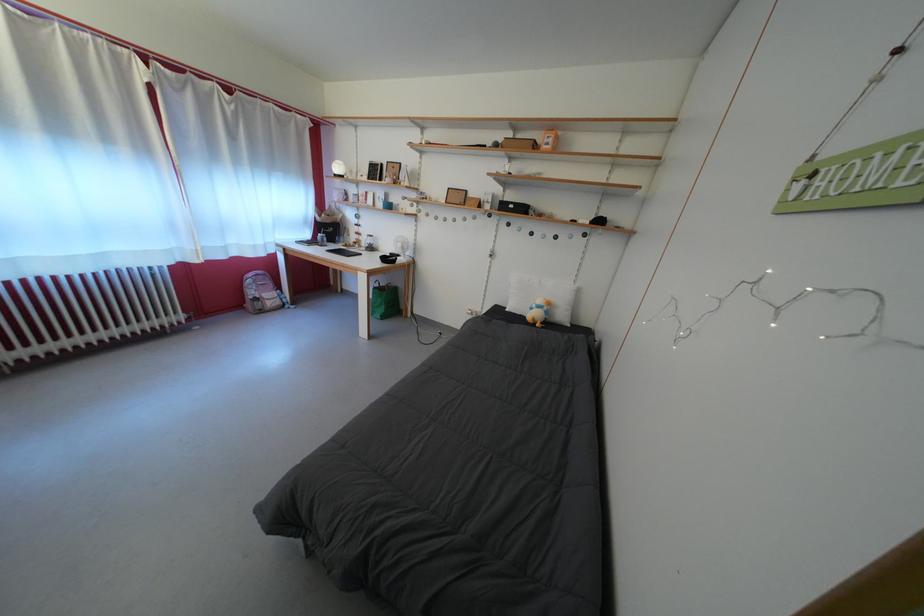
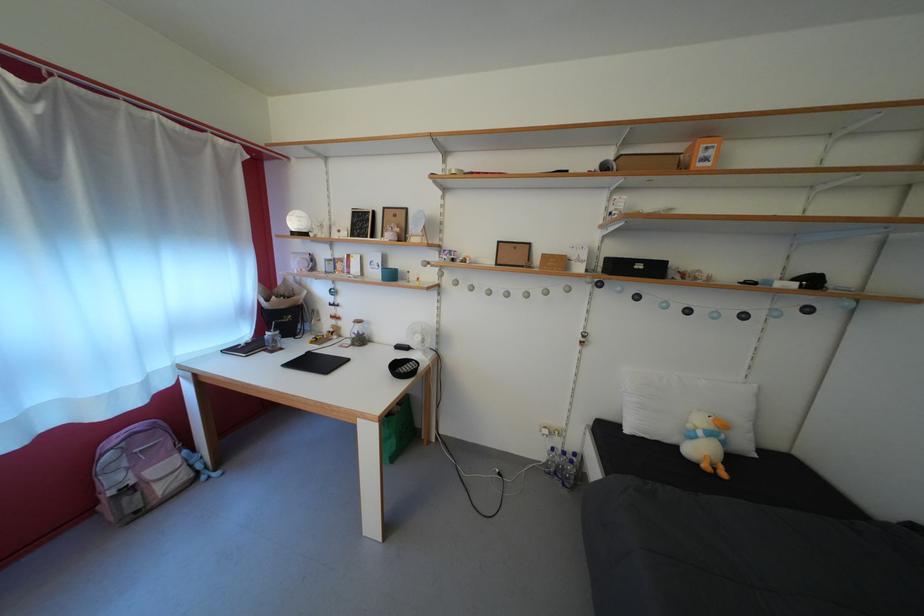
In the second image, find the point that corresponds to point (519, 213) in the first image.

(648, 273)